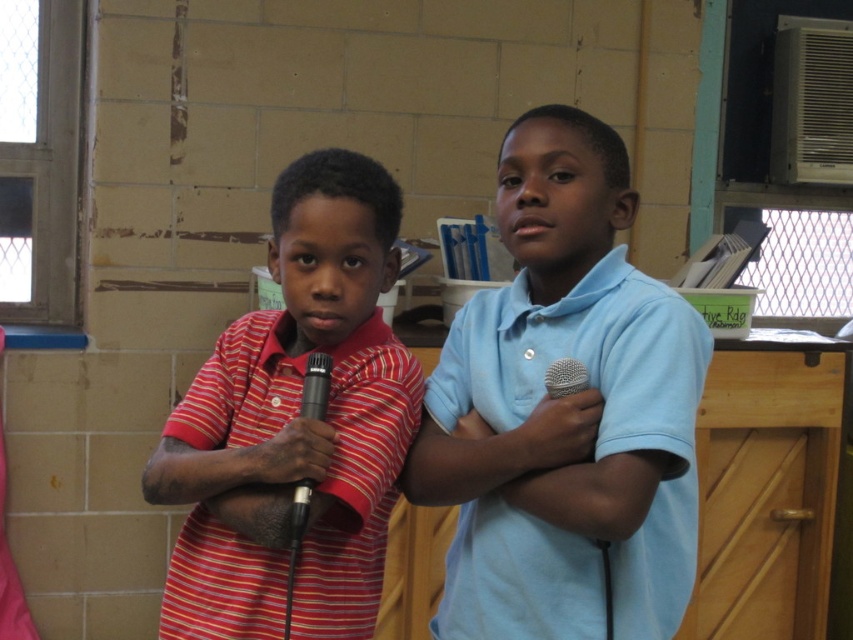
Is the position of matte blue shirt at center more distant than that of striped cotton shirt at center?

No.

Is matte blue shirt at center above striped cotton shirt at center?

Indeed, matte blue shirt at center is positioned over striped cotton shirt at center.

The image size is (853, 640). I want to click on matte blue shirt at center, so pyautogui.click(x=566, y=410).

The image size is (853, 640). I want to click on matte blue shirt at center, so click(566, 410).

Which is in front, point (315, 371) or point (549, 390)?

Positioned in front is point (315, 371).

Based on the photo, can you confirm if black metallic microphone at center is wider than black matte microphone at center?

In fact, black metallic microphone at center might be narrower than black matte microphone at center.

I want to click on black metallic microphone at center, so click(x=315, y=387).

Does striped cotton shirt at center lie in front of black metallic microphone at center?

That is False.

I want to click on striped cotton shirt at center, so click(x=294, y=424).